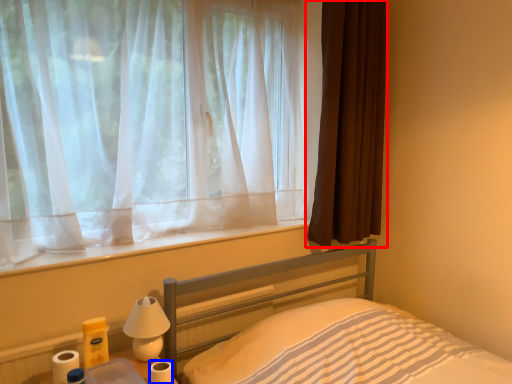
Question: Which of the following is the farthest to the observer, curtain (highlighted by a red box) or toilet paper (highlighted by a blue box)?

Choices:
 (A) curtain
 (B) toilet paper

Answer: (A)